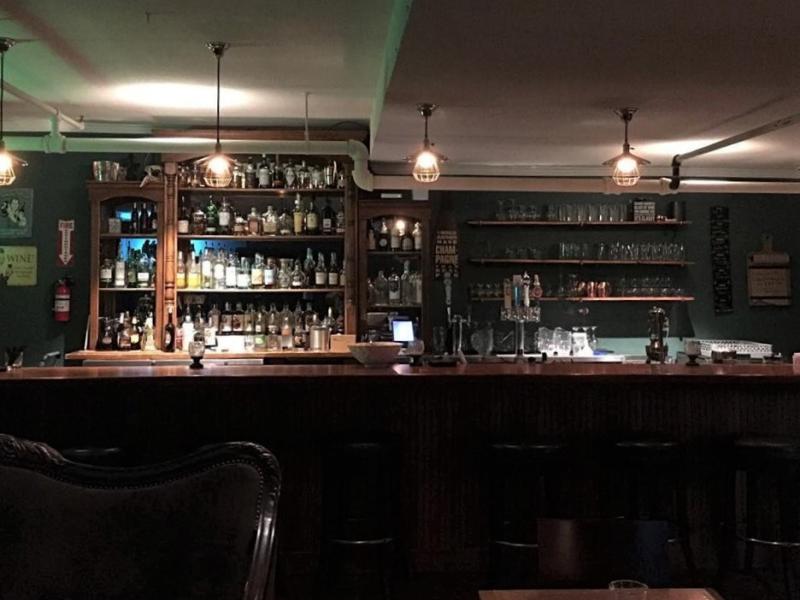
You are a GUI agent. You are given a task and a screenshot of the screen. Output one action in this format:
    pyautogui.click(x=<x>, y=<y>)
    Task: Click on the taps
    The image size is (800, 600).
    Given the screenshot: What is the action you would take?
    pyautogui.click(x=504, y=295), pyautogui.click(x=521, y=293), pyautogui.click(x=529, y=301), pyautogui.click(x=534, y=288)